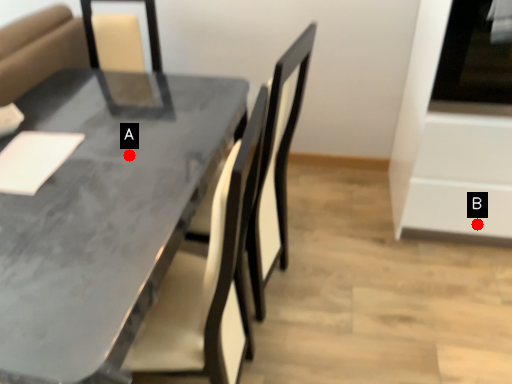
Question: Two points are circled on the image, labeled by A and B beside each circle. Which point is closer to the camera?

Choices:
 (A) A is closer
 (B) B is closer

Answer: (A)